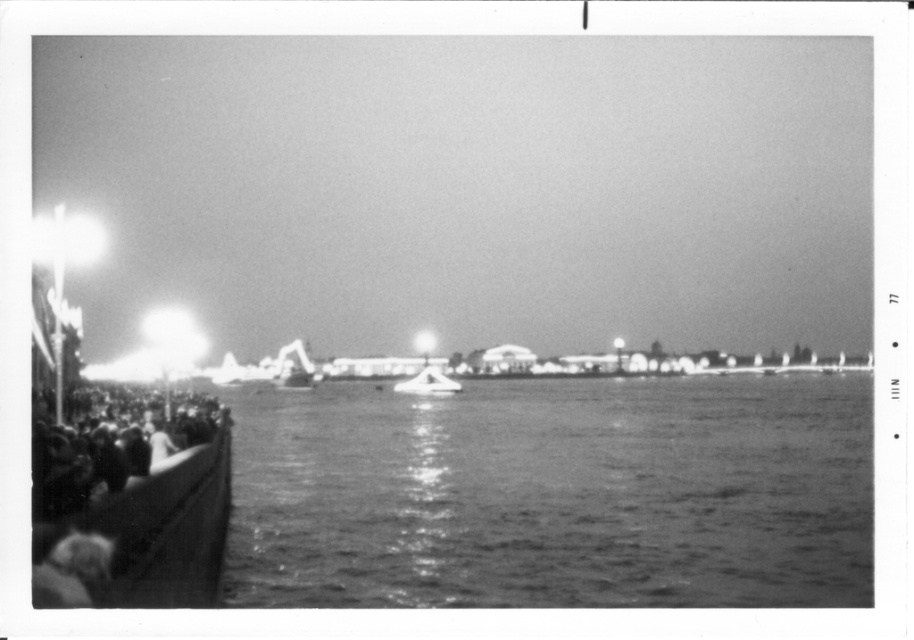
You are standing at the point with coordinates point [144,481] and want to walk to the point with coordinates point [847,477]. Is there a clear path between these two points?

Point [847,477] is behind point [144,481], so there might not be a clear path between them as the first point is obstructed by the second.

You are a photographer trying to capture the reflection of the metallic silver boat at center in the smooth water at center. Based on the scene description, will you be able to see the reflection clearly?

The smooth water at center is positioned under metallic silver boat at center, so the boat is likely blocking the reflection of the water below it, making it difficult to see the reflection clearly.

You are a photographer trying to capture the entire metallic silver boat at center and smooth water at center in one frame. Based on the scene, can you fit both objects in your camera view without moving the camera? Explain your reasoning.

The smooth water at center is wider than the metallic silver boat at center, so if the camera is positioned to include the wider smooth water at center, the metallic silver boat at center would also fit within the frame since it is narrower.